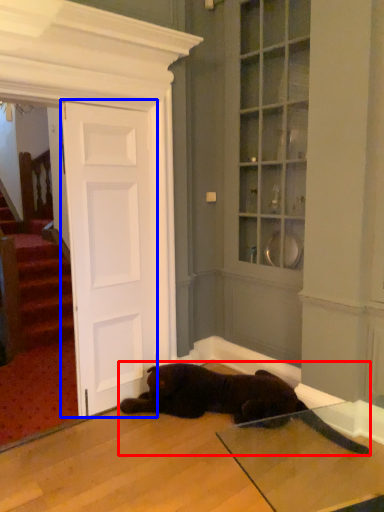
Question: Which of the following is the closest to the observer, cat (highlighted by a red box) or door (highlighted by a blue box)?

Choices:
 (A) cat
 (B) door

Answer: (A)